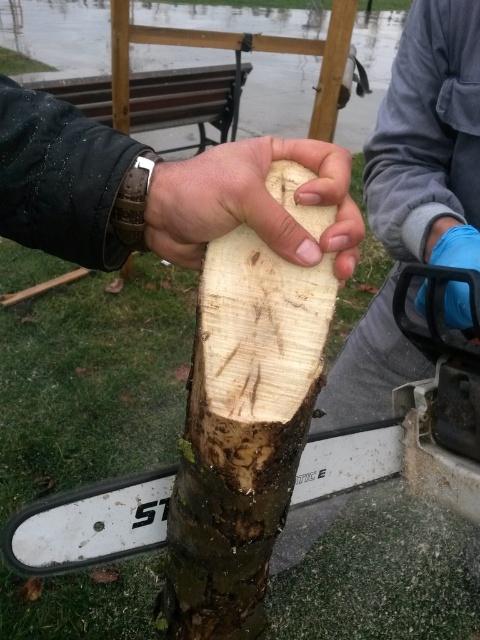
Consider the image. Is light brown wood at center bigger than natural wood at center?

No, light brown wood at center is not bigger than natural wood at center.

Locate an element on the screen. The height and width of the screenshot is (640, 480). light brown wood at center is located at coordinates (241, 433).

How far apart are wooden plank at center and natural wood at center?

A distance of 1.23 inches exists between wooden plank at center and natural wood at center.

Does wooden plank at center have a greater height compared to natural wood at center?

No.

Which is behind, point (99, 128) or point (298, 156)?

The point (99, 128) is behind.

Identify the location of wooden plank at center. (156, 189).

Which of these two, light brown wood at center or wooden plank at center, stands taller?

With more height is light brown wood at center.

Can you confirm if light brown wood at center is positioned to the left of wooden plank at center?

No, light brown wood at center is not to the left of wooden plank at center.

This screenshot has width=480, height=640. What are the coordinates of `light brown wood at center` in the screenshot? It's located at (x=241, y=433).

Image resolution: width=480 pixels, height=640 pixels. In order to click on light brown wood at center in this screenshot , I will do `click(241, 433)`.